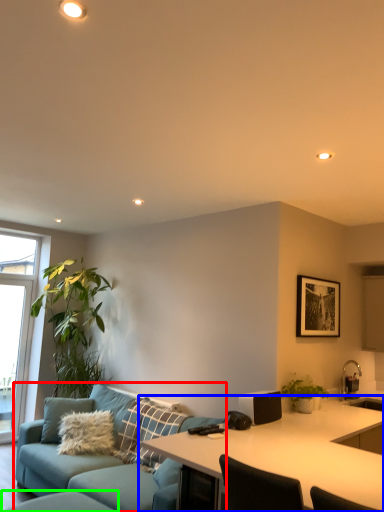
Question: Which object is the farthest from studio couch (highlighted by a red box)? Choose among these: desk (highlighted by a blue box) or swivel chair (highlighted by a green box).

Choices:
 (A) desk
 (B) swivel chair

Answer: (A)